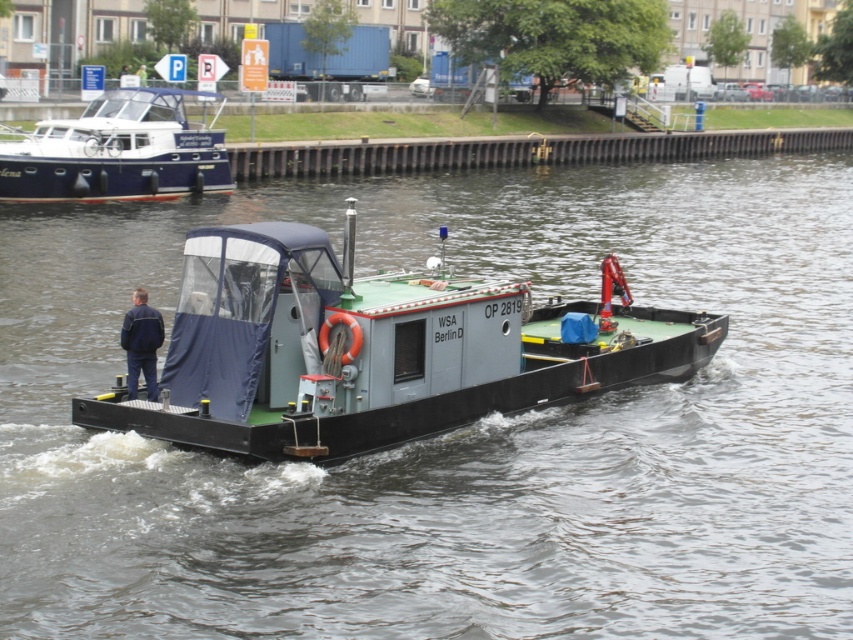
You are navigating a small boat on the canal and need to pass between two points marked on your map as point (160, 417) and point (35, 176). According to the scene, which point should you approach first to stay on course?

You should approach point (35, 176) first because point (160, 417) is in front of it, meaning point (35, 176) is located behind and thus comes later in your path.

From the picture: You are standing on the bank of the waterway and see the gray matte barge at center and the navy blue jacket at left. Which object is nearer to you?

The gray matte barge at center is closer to the viewer than the navy blue jacket at left.